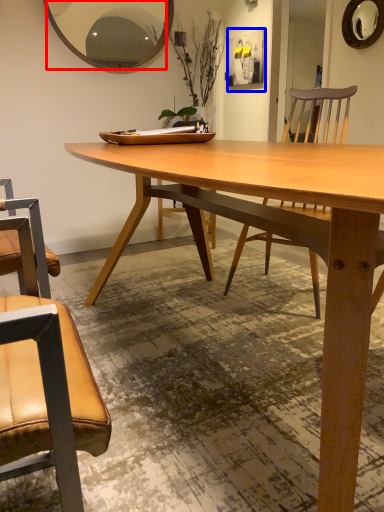
Question: Which object appears farthest to the camera in this image, mirror (highlighted by a red box) or picture frame (highlighted by a blue box)?

Choices:
 (A) mirror
 (B) picture frame

Answer: (B)